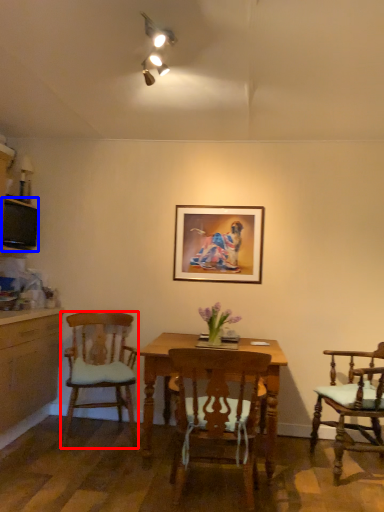
Question: Among these objects, which one is nearest to the camera, chair (highlighted by a red box) or television (highlighted by a blue box)?

Choices:
 (A) chair
 (B) television

Answer: (A)